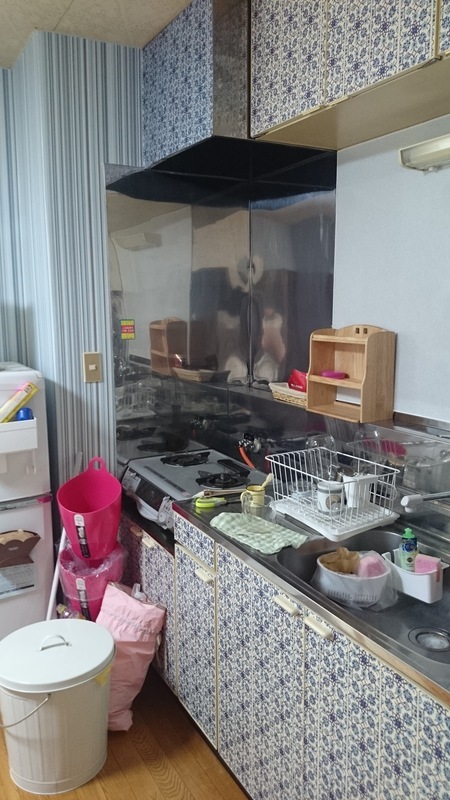
You are a GUI agent. You are given a task and a screenshot of the screen. Output one action in this format:
    pyautogui.click(x=<x>, y=<y>)
    Task: Click on the wall above lightswitch
    
    Given the screenshot: What is the action you would take?
    pyautogui.click(x=86, y=286)